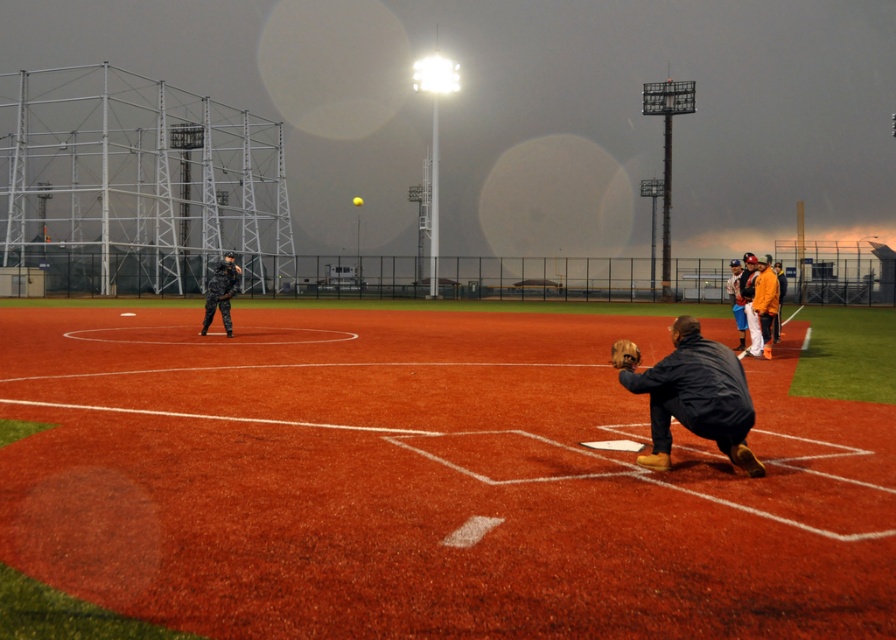
You are a photographer standing at the edge of the field. You want to capture a shot of the dark blue jacket at lower right and the rubberized orange turf at center in the same frame. Based on their positions, which object is closer to the photographer?

The dark blue jacket at lower right is closer to the photographer because the rubberized orange turf at center is to the left of it, implying the jacket is in front.

You are a coach planning to place two markers on the field. You have a rubberized orange turf at center and a camouflage uniform at center. Which object will allow you to place the marker farther from the home plate without overlapping either object?

The rubberized orange turf at center has a larger width than the camouflage uniform at center, so placing the marker farther from home plate would be possible near the rubberized orange turf at center since it occupies more space.

You are a coach standing at the edge of the infield. You see the rubberized orange turf at center. Where is the rubberized orange turf at center located relative to the point marked at coordinates (x=426, y=481)?

The rubberized orange turf at center is located exactly at the point marked at coordinates (x=426, y=481).